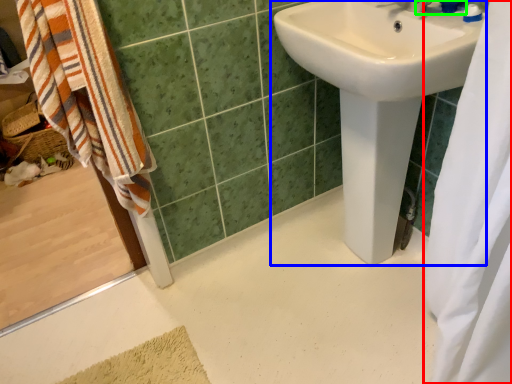
Question: Which object is the farthest from shower curtain (highlighted by a red box)? Choose among these: sink (highlighted by a blue box) or plumbing fixture (highlighted by a green box).

Choices:
 (A) sink
 (B) plumbing fixture

Answer: (B)